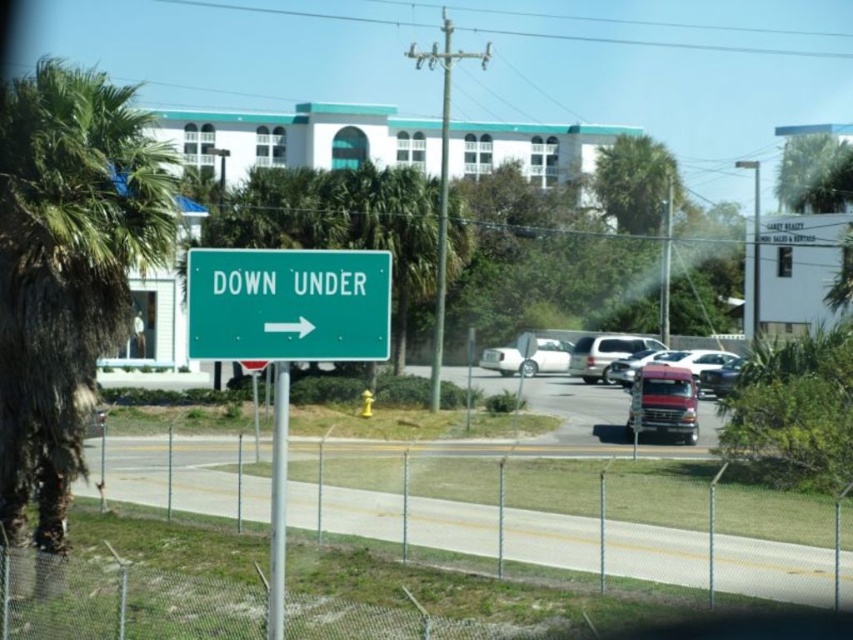
Question: In this image, where is green plastic sign at center located relative to metallic red truck at center?

Choices:
 (A) above
 (B) below

Answer: (A)

Question: Which point is closer to the camera taking this photo?

Choices:
 (A) (169, 256)
 (B) (253, 269)
 (C) (851, 170)
 (D) (496, 349)

Answer: (B)

Question: In this image, where is metallic pole at center located relative to white matte sedan at center?

Choices:
 (A) below
 (B) above

Answer: (A)

Question: Which point is closer to the camera?

Choices:
 (A) (645, 355)
 (B) (793, 140)

Answer: (A)

Question: Does green plastic sign at center have a lesser width compared to white matte sedan at center?

Choices:
 (A) no
 (B) yes

Answer: (B)

Question: Based on their relative distances, which object is farther from the green leafy palm tree at upper right?

Choices:
 (A) white matte sedan at center
 (B) metallic red truck at center
 (C) green leafy palm tree at left
 (D) metallic pole at center

Answer: (D)